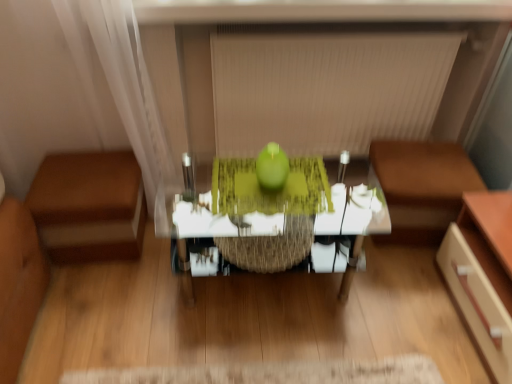
This screenshot has height=384, width=512. What are the coordinates of `blank space situated above brown leather couch at right, the 1th furniture from the right (from a real-world perspective)` in the screenshot? It's located at (425, 166).